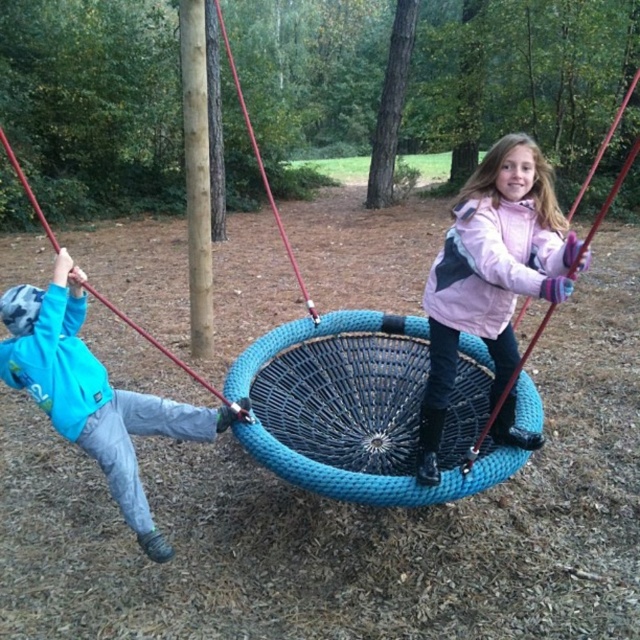
You are a photographer trying to capture both the blue fleece sweatshirt at left and the pink fleece sweatshirt at upper center in the same frame. Based on their positions, which one should you focus on first to ensure both are in the shot?

The blue fleece sweatshirt at left has a greater height compared to pink fleece sweatshirt at upper center, so you should focus on the blue fleece sweatshirt at left first to ensure both are in the shot.

You are standing at the playground and want to reach the point marked as point (522, 163). If you take a step forward, will you be closer to or farther from the point?

The point (522, 163) is 8.83 feet from the viewer. Taking a step forward would decrease the distance, so you would be closer to the point.

You are a photographer trying to capture both the pink fleece jacket at center and the pink fleece sweatshirt at upper center in a single shot. Which object should you position closer to the left side of your camera frame to ensure both are visible?

To ensure both the pink fleece jacket at center and the pink fleece sweatshirt at upper center are visible in the photo, position the pink fleece jacket at center closer to the left side of the camera frame since it is already to the left of the pink fleece sweatshirt at upper center.